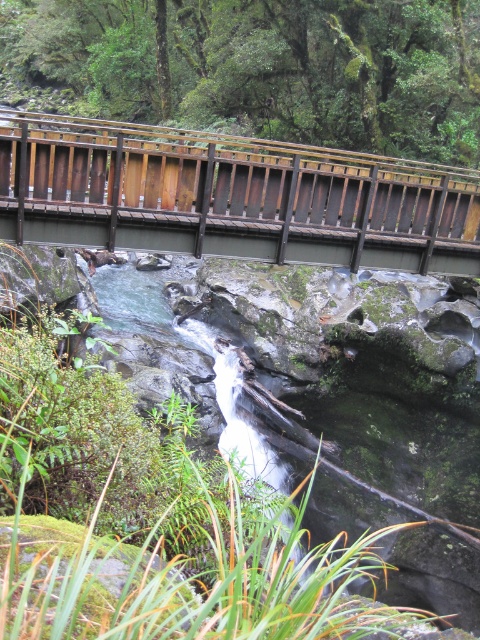
Can you confirm if green mossy rocks at upper center is positioned to the right of brown wooden bridge at upper center?

No, green mossy rocks at upper center is not to the right of brown wooden bridge at upper center.

Between point (244, 4) and point (463, 266), which one is positioned behind?

The point (244, 4) is more distant.

In order to click on green mossy rocks at upper center in this screenshot , I will do `click(257, 68)`.